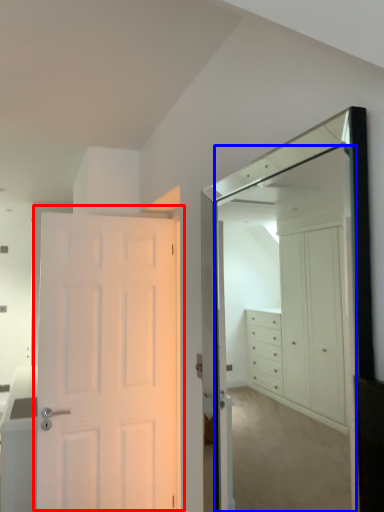
Question: Which point is closer to the camera, door (highlighted by a red box) or mirror (highlighted by a blue box)?

Choices:
 (A) door
 (B) mirror

Answer: (B)